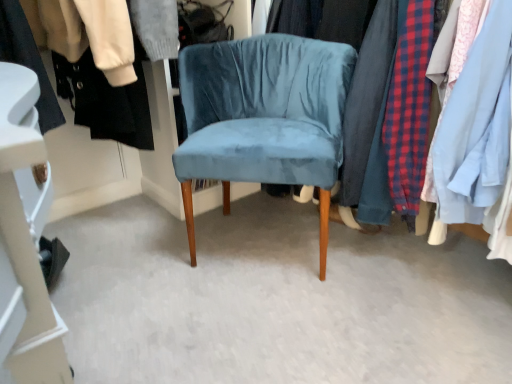
What is the approximate height of black fabric shoe at lower left, positioned as the 2th closet in right-to-left order?

black fabric shoe at lower left, positioned as the 2th closet in right-to-left order, is 16.87 inches tall.

Locate an element on the screen. This screenshot has height=384, width=512. velvet fabric clothes at center, the second closet from the left is located at coordinates (478, 133).

Is velvet fabric clothes at center, positioned as the first closet in right-to-left order, outside of black fabric shoe at lower left, positioned as the 2th closet in right-to-left order?

velvet fabric clothes at center, positioned as the first closet in right-to-left order, lies outside black fabric shoe at lower left, positioned as the 2th closet in right-to-left order,'s area.

Is velvet fabric clothes at center, the second closet from the left, bigger than black fabric shoe at lower left, the first closet positioned from the left?

Indeed, velvet fabric clothes at center, the second closet from the left, has a larger size compared to black fabric shoe at lower left, the first closet positioned from the left.

Can you confirm if velvet fabric clothes at center, positioned as the first closet in right-to-left order, is shorter than black fabric shoe at lower left, the first closet positioned from the left?

No, velvet fabric clothes at center, positioned as the first closet in right-to-left order, is not shorter than black fabric shoe at lower left, the first closet positioned from the left.

Is black fabric shoe at lower left, the first closet positioned from the left, at the back of velvet fabric clothes at center, the second closet from the left?

No, velvet fabric clothes at center, the second closet from the left, is not facing the opposite direction of black fabric shoe at lower left, the first closet positioned from the left.

From the image's perspective, is velvet blue chair at center positioned above or below velvet fabric clothes at center, the second closet from the left?

Based on their image positions, velvet blue chair at center is located beneath velvet fabric clothes at center, the second closet from the left.

Is velvet blue chair at center positioned beyond the bounds of velvet fabric clothes at center, positioned as the first closet in right-to-left order?

velvet blue chair at center is positioned outside velvet fabric clothes at center, positioned as the first closet in right-to-left order.

Is velvet blue chair at center touching velvet fabric clothes at center, positioned as the first closet in right-to-left order?

They are not placed beside each other.

Can you tell me how much velvet blue chair at center and velvet fabric clothes at center, positioned as the first closet in right-to-left order, differ in facing direction?

The angle between the facing direction of velvet blue chair at center and the facing direction of velvet fabric clothes at center, positioned as the first closet in right-to-left order, is 43.8 degrees.

Which object is thinner, black fabric shoe at lower left, positioned as the 2th closet in right-to-left order, or velvet fabric clothes at center, the second closet from the left?

With smaller width is black fabric shoe at lower left, positioned as the 2th closet in right-to-left order.

From the image's perspective, is black fabric shoe at lower left, positioned as the 2th closet in right-to-left order, located above or below velvet fabric clothes at center, positioned as the first closet in right-to-left order?

From the image's perspective, black fabric shoe at lower left, positioned as the 2th closet in right-to-left order, appears below velvet fabric clothes at center, positioned as the first closet in right-to-left order.

Considering their positions, is black fabric shoe at lower left, the first closet positioned from the left, located in front of or behind velvet fabric clothes at center, the second closet from the left?

black fabric shoe at lower left, the first closet positioned from the left, is behind velvet fabric clothes at center, the second closet from the left.

Who is bigger, black fabric shoe at lower left, the first closet positioned from the left, or velvet fabric clothes at center, positioned as the first closet in right-to-left order?

Bigger between the two is velvet fabric clothes at center, positioned as the first closet in right-to-left order.

From the image's perspective, is velvet blue chair at center located above or below black fabric shoe at lower left, the first closet positioned from the left?

velvet blue chair at center is above black fabric shoe at lower left, the first closet positioned from the left.

Is velvet blue chair at center in front of or behind black fabric shoe at lower left, the first closet positioned from the left, in the image?

Visually, velvet blue chair at center is located in front of black fabric shoe at lower left, the first closet positioned from the left.

Does velvet blue chair at center have a greater height compared to black fabric shoe at lower left, positioned as the 2th closet in right-to-left order?

Yes, velvet blue chair at center is taller than black fabric shoe at lower left, positioned as the 2th closet in right-to-left order.

Considering the positions of points (239, 168) and (36, 275), is point (239, 168) closer to camera compared to point (36, 275)?

No.

Which object is wider, velvet fabric clothes at center, positioned as the first closet in right-to-left order, or velvet blue chair at center?

With larger width is velvet fabric clothes at center, positioned as the first closet in right-to-left order.

Is velvet fabric clothes at center, positioned as the first closet in right-to-left order, directly adjacent to velvet blue chair at center?

No, velvet fabric clothes at center, positioned as the first closet in right-to-left order, is not with velvet blue chair at center.

Measure the distance from velvet fabric clothes at center, the second closet from the left, to velvet blue chair at center.

velvet fabric clothes at center, the second closet from the left, and velvet blue chair at center are 17.42 inches apart.

Considering the relative sizes of velvet fabric clothes at center, positioned as the first closet in right-to-left order, and velvet blue chair at center in the image provided, is velvet fabric clothes at center, positioned as the first closet in right-to-left order, smaller than velvet blue chair at center?

No, velvet fabric clothes at center, positioned as the first closet in right-to-left order, is not smaller than velvet blue chair at center.

Is black fabric shoe at lower left, positioned as the 2th closet in right-to-left order, beside velvet blue chair at center?

No, black fabric shoe at lower left, positioned as the 2th closet in right-to-left order, is not making contact with velvet blue chair at center.

Is black fabric shoe at lower left, positioned as the 2th closet in right-to-left order, further to camera compared to velvet blue chair at center?

That is True.

At what (x,y) coordinates should I click in order to perform the action: click on closet below the velvet blue chair at center (from the image's perspective). Please return your answer as a coordinate pair (x, y). The width and height of the screenshot is (512, 384). Looking at the image, I should click on (25, 239).

Is black fabric shoe at lower left, the first closet positioned from the left, oriented towards velvet blue chair at center?

No, black fabric shoe at lower left, the first closet positioned from the left, is not oriented towards velvet blue chair at center.

Locate an element on the screen. The height and width of the screenshot is (384, 512). closet above the black fabric shoe at lower left, the first closet positioned from the left (from a real-world perspective) is located at coordinates (478, 133).

Locate an element on the screen. The width and height of the screenshot is (512, 384). closet in front of the velvet blue chair at center is located at coordinates pyautogui.click(x=478, y=133).

Considering their positions, is black fabric shoe at lower left, positioned as the 2th closet in right-to-left order, positioned closer to velvet fabric clothes at center, the second closet from the left, than velvet blue chair at center?

velvet blue chair at center lies closer to velvet fabric clothes at center, the second closet from the left, than the other object.

From the image, which object appears to be farther from velvet blue chair at center, velvet fabric clothes at center, positioned as the first closet in right-to-left order, or black fabric shoe at lower left, the first closet positioned from the left?

black fabric shoe at lower left, the first closet positioned from the left, is further to velvet blue chair at center.

Which object lies nearer to the anchor point black fabric shoe at lower left, the first closet positioned from the left, velvet fabric clothes at center, positioned as the first closet in right-to-left order, or velvet blue chair at center?

velvet blue chair at center lies closer to black fabric shoe at lower left, the first closet positioned from the left, than the other object.

Estimate the real-world distances between objects in this image. Which object is further from black fabric shoe at lower left, positioned as the 2th closet in right-to-left order, velvet blue chair at center or velvet fabric clothes at center, positioned as the first closet in right-to-left order?

The object further to black fabric shoe at lower left, positioned as the 2th closet in right-to-left order, is velvet fabric clothes at center, positioned as the first closet in right-to-left order.

Looking at the image, which one is located further to velvet blue chair at center, black fabric shoe at lower left, positioned as the 2th closet in right-to-left order, or velvet fabric clothes at center, positioned as the first closet in right-to-left order?

black fabric shoe at lower left, positioned as the 2th closet in right-to-left order.

From the image, which object appears to be farther from velvet fabric clothes at center, the second closet from the left, velvet blue chair at center or black fabric shoe at lower left, the first closet positioned from the left?

black fabric shoe at lower left, the first closet positioned from the left.

Find the location of a particular element. This screenshot has height=384, width=512. chair between black fabric shoe at lower left, positioned as the 2th closet in right-to-left order, and velvet fabric clothes at center, positioned as the first closet in right-to-left order, from left to right is located at coordinates (262, 112).